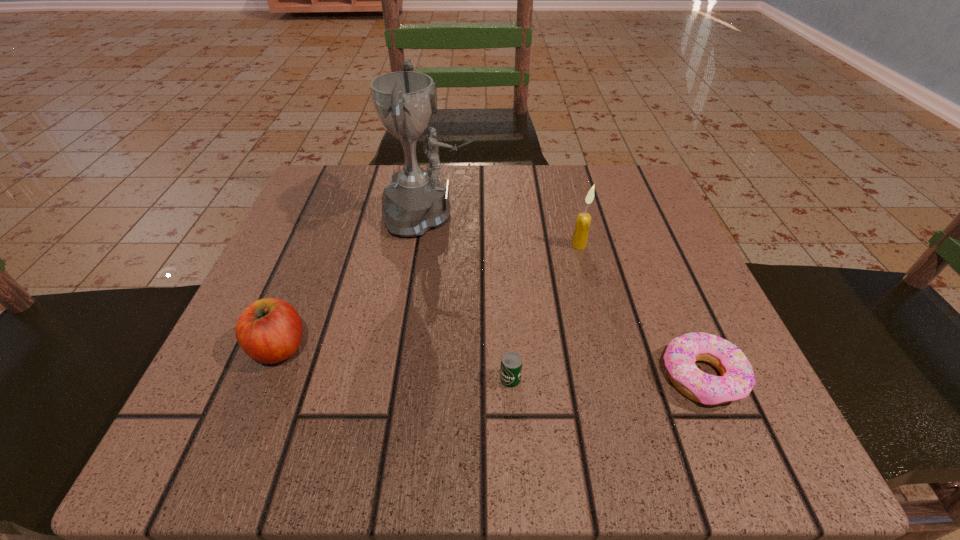
Identify the location of free space located 0.050m on the right of the apple. The height and width of the screenshot is (540, 960). click(x=342, y=348).

Locate an element on the screen. blank space located 0.050m on the right of the third object from left to right is located at coordinates click(x=565, y=379).

I want to click on free location located 0.320m on the back of the rightmost object, so click(634, 216).

This screenshot has width=960, height=540. What are the coordinates of `object located at the far edge` in the screenshot? It's located at (416, 201).

This screenshot has width=960, height=540. In order to click on beer can that is at the near edge in this screenshot , I will do `click(511, 364)`.

I want to click on doughnut at the near edge, so click(737, 379).

Image resolution: width=960 pixels, height=540 pixels. Identify the location of object that is at the left edge. (270, 330).

Where is `object that is at the right edge`? object that is at the right edge is located at coordinates (737, 379).

Find the location of a particular element. object at the near right corner is located at coordinates (737, 379).

Image resolution: width=960 pixels, height=540 pixels. I want to click on vacant space at the far edge, so click(x=537, y=194).